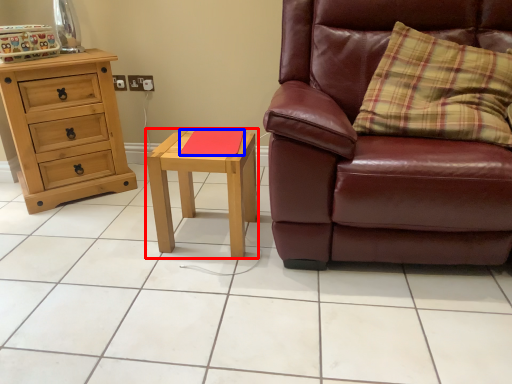
Question: Which point is closer to the camera, nightstand (highlighted by a red box) or pad (highlighted by a blue box)?

Choices:
 (A) nightstand
 (B) pad

Answer: (A)